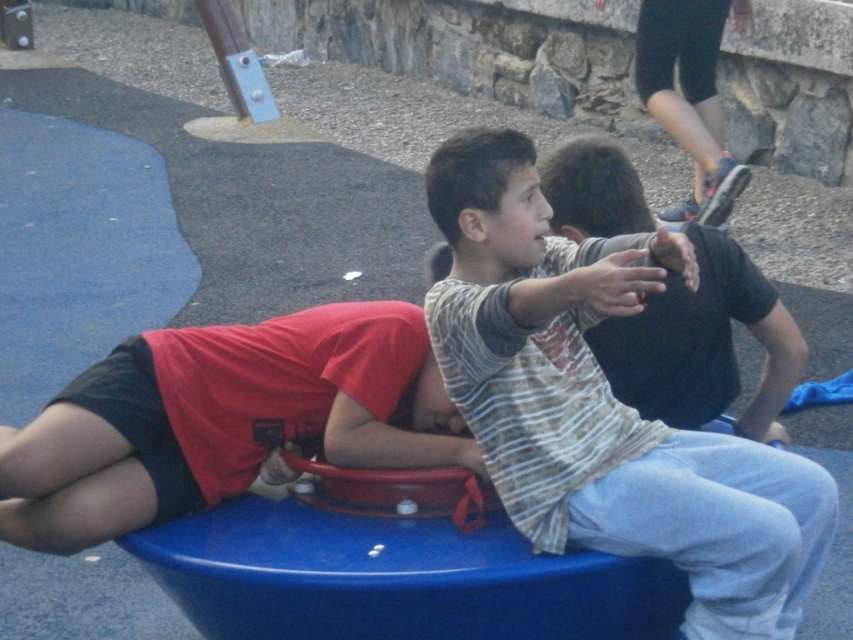
Who is lower down, striped cotton shirt at center or matte red shirt at lower left?

matte red shirt at lower left

Is point (613, 502) behind point (305, 320)?

No, (613, 502) is closer to viewer.

Where is `striped cotton shirt at center`? This screenshot has width=853, height=640. striped cotton shirt at center is located at coordinates (602, 403).